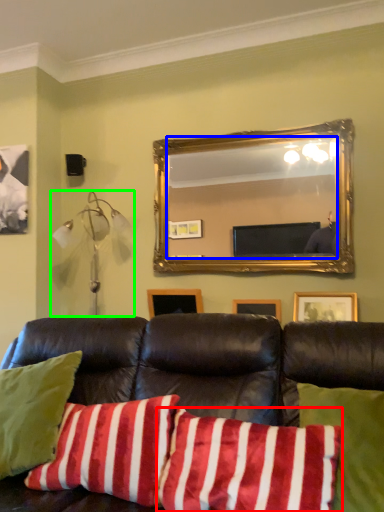
Question: Considering the real-world distances, which object is closest to pillow (highlighted by a red box)? mirror (highlighted by a blue box) or lamp (highlighted by a green box).

Choices:
 (A) mirror
 (B) lamp

Answer: (B)